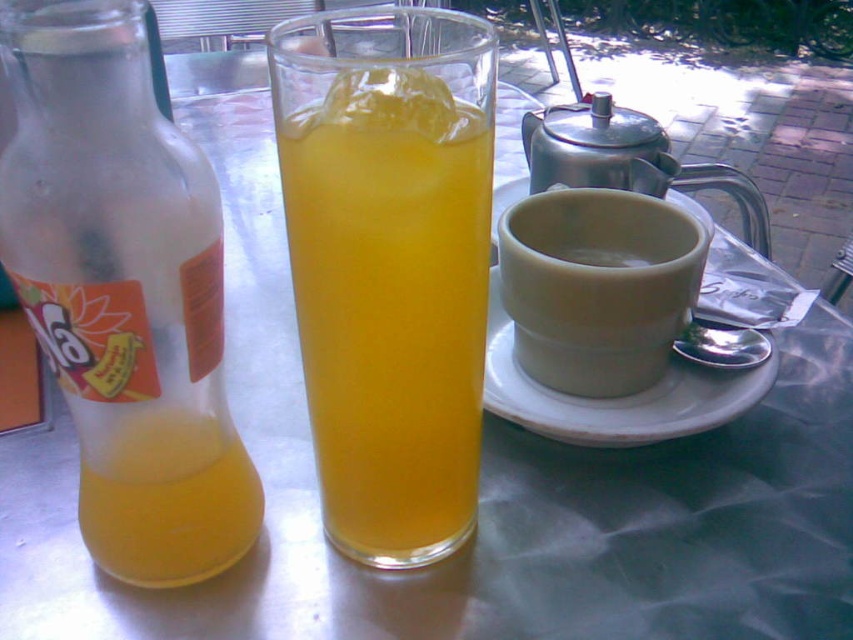
Question: Which is farther from the white ceramic saucer at right?

Choices:
 (A) translucent glass bottle at left
 (B) translucent glass at center

Answer: (A)

Question: Among these objects, which one is farthest from the camera?

Choices:
 (A) translucent glass bottle at left
 (B) translucent glass at center

Answer: (B)

Question: Does translucent glass bottle at left have a smaller size compared to matte ceramic mug at right?

Choices:
 (A) yes
 (B) no

Answer: (B)

Question: Which object appears farthest from the camera in this image?

Choices:
 (A) white ceramic saucer at right
 (B) matte ceramic mug at right
 (C) translucent glass bottle at left
 (D) translucent glass at center

Answer: (A)

Question: Observing the image, what is the correct spatial positioning of translucent glass at center in reference to translucent glass bottle at left?

Choices:
 (A) below
 (B) above

Answer: (B)

Question: Can you confirm if matte ceramic mug at right is positioned below white ceramic saucer at right?

Choices:
 (A) yes
 (B) no

Answer: (B)